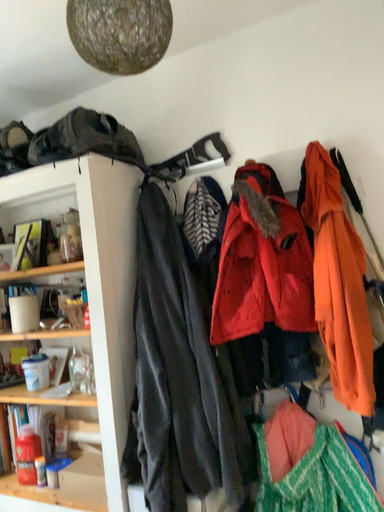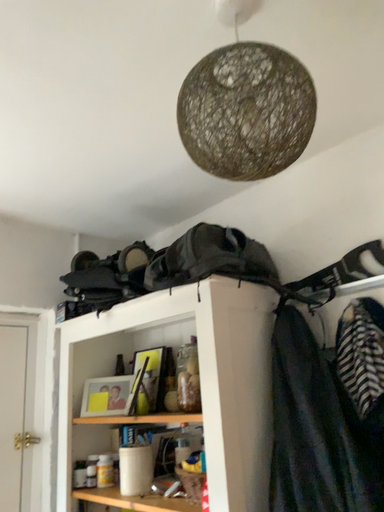
Question: Which way did the camera rotate in the video?

Choices:
 (A) rotated left
 (B) rotated right

Answer: (A)